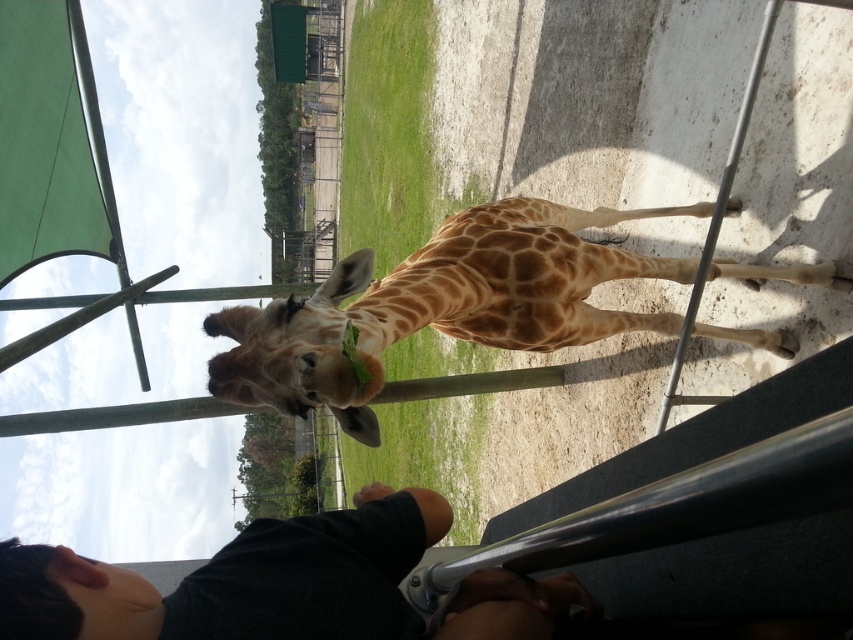
How much distance is there between spotted fur giraffe at center and black skin at lower left?

A distance of 2.65 meters exists between spotted fur giraffe at center and black skin at lower left.

You are a GUI agent. You are given a task and a screenshot of the screen. Output one action in this format:
    pyautogui.click(x=<x>, y=<y>)
    Task: Click on the spotted fur giraffe at center
    The width and height of the screenshot is (853, 640).
    Given the screenshot: What is the action you would take?
    pyautogui.click(x=439, y=307)

Between point (212, 604) and point (117, 582), which one is positioned behind?

Point (117, 582)

The height and width of the screenshot is (640, 853). Identify the location of dark gray shirt at lower center. (241, 579).

Which is in front, point (480, 237) or point (183, 625)?

Point (183, 625) is in front.

Does spotted fur giraffe at center appear over dark gray shirt at lower center?

Indeed, spotted fur giraffe at center is positioned over dark gray shirt at lower center.

The width and height of the screenshot is (853, 640). What are the coordinates of `spotted fur giraffe at center` in the screenshot? It's located at tap(439, 307).